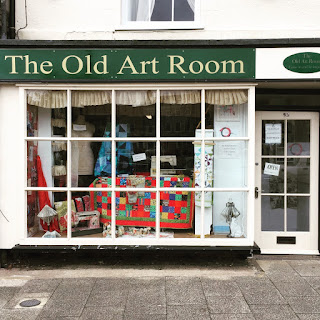
Locate an element on the screen. The height and width of the screenshot is (320, 320). mail slot is located at coordinates (280, 238).